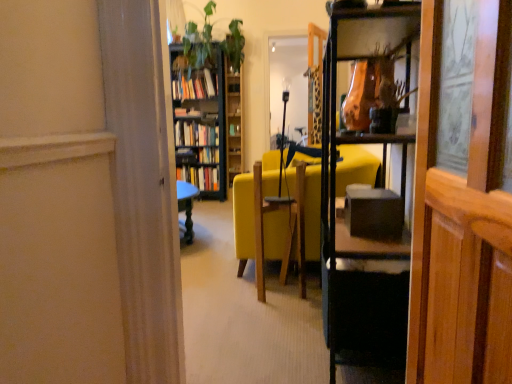
Where is `vacant space situated on the left part of wooden swivel chair at center`? This screenshot has height=384, width=512. vacant space situated on the left part of wooden swivel chair at center is located at coordinates (236, 289).